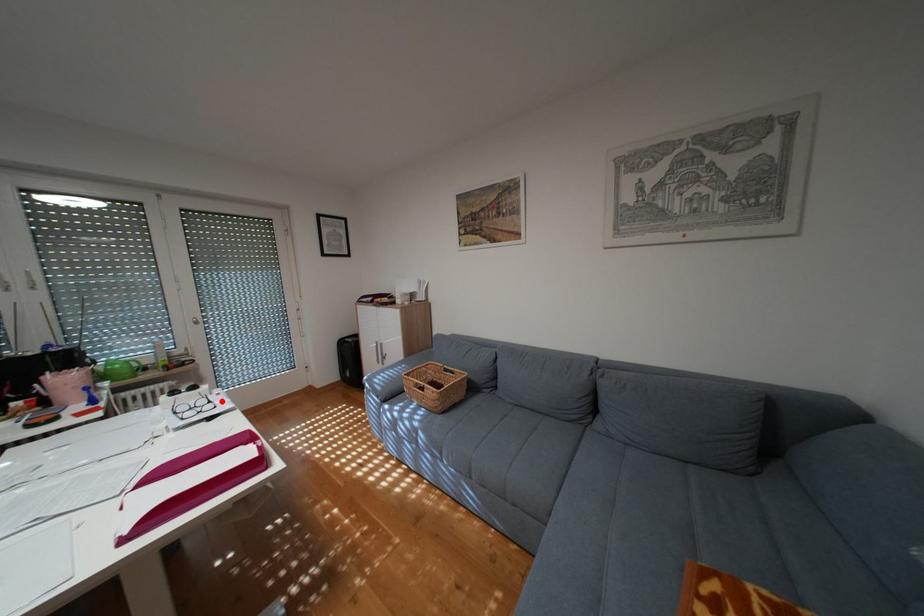
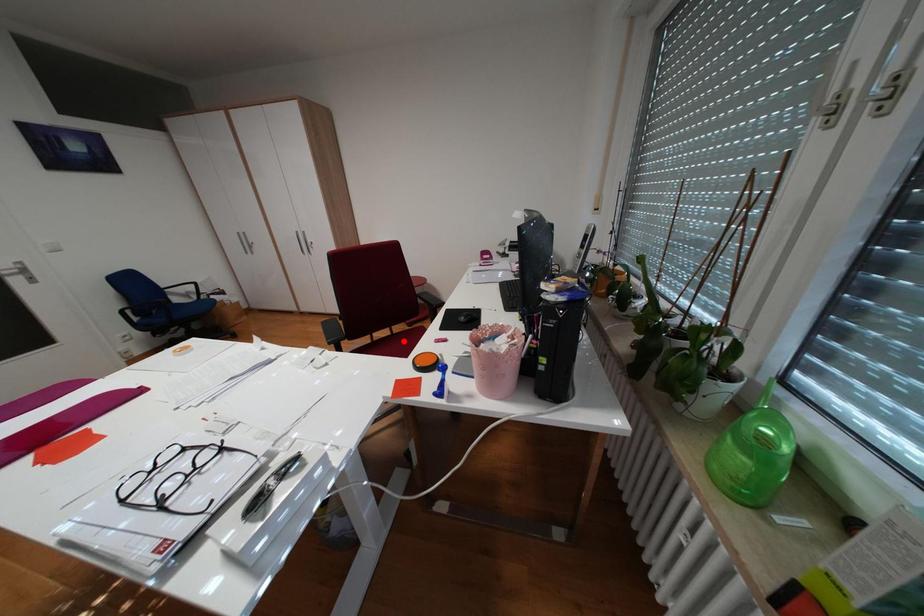
I am providing you with two images of the same scene from different viewpoints. A red point is marked on the first image and another point is marked on the second image. Is the red point in image1 aligned with the point shown in image2?

No